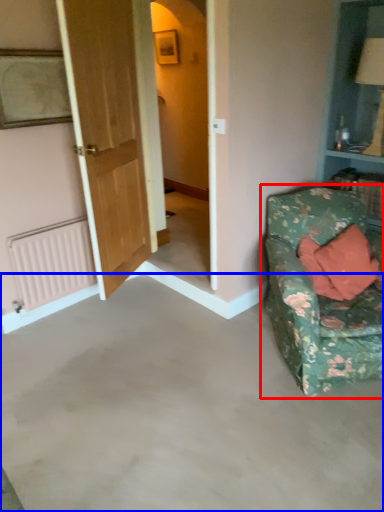
Question: Among these objects, which one is nearest to the camera, studio couch (highlighted by a red box) or concrete (highlighted by a blue box)?

Choices:
 (A) studio couch
 (B) concrete

Answer: (B)